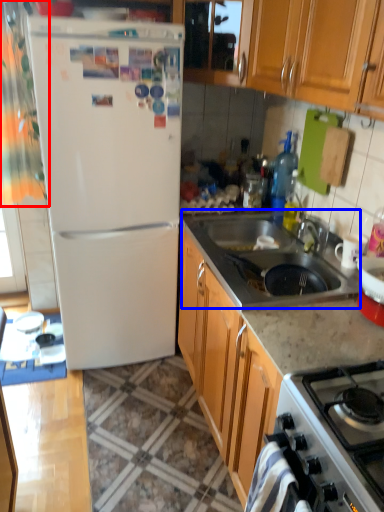
Question: Which of the following is the farthest to the observer, curtain (highlighted by a red box) or sink (highlighted by a blue box)?

Choices:
 (A) curtain
 (B) sink

Answer: (A)